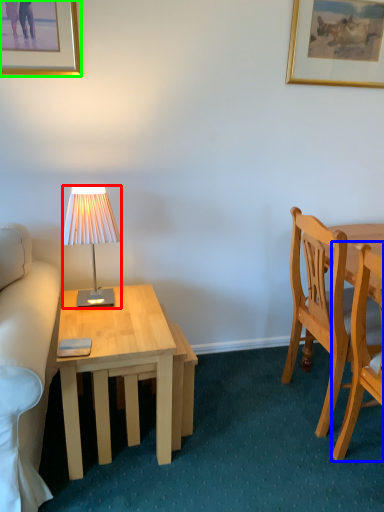
Question: Which object is positioned farthest from lamp (highlighted by a red box)? Select from chair (highlighted by a blue box) and picture frame (highlighted by a green box).

Choices:
 (A) chair
 (B) picture frame

Answer: (A)